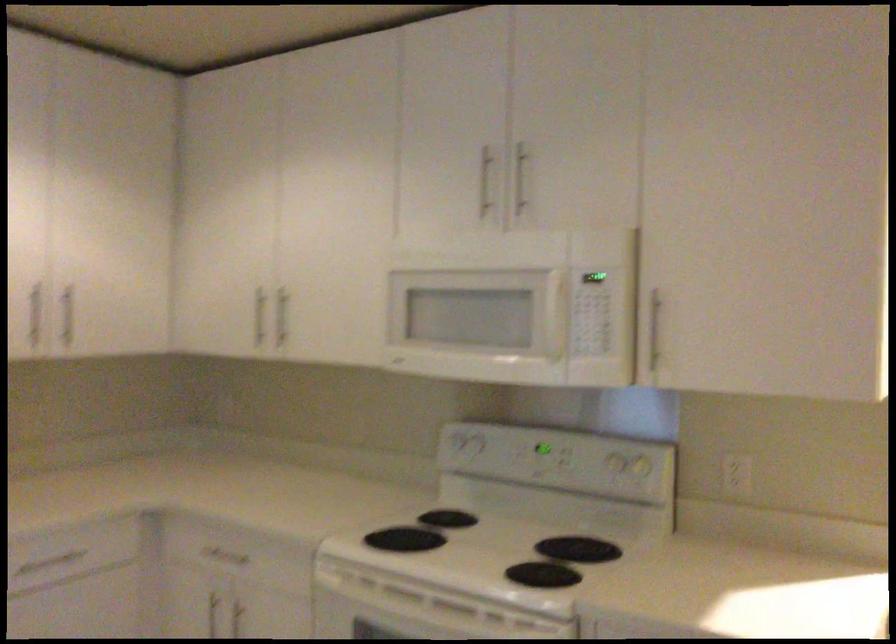
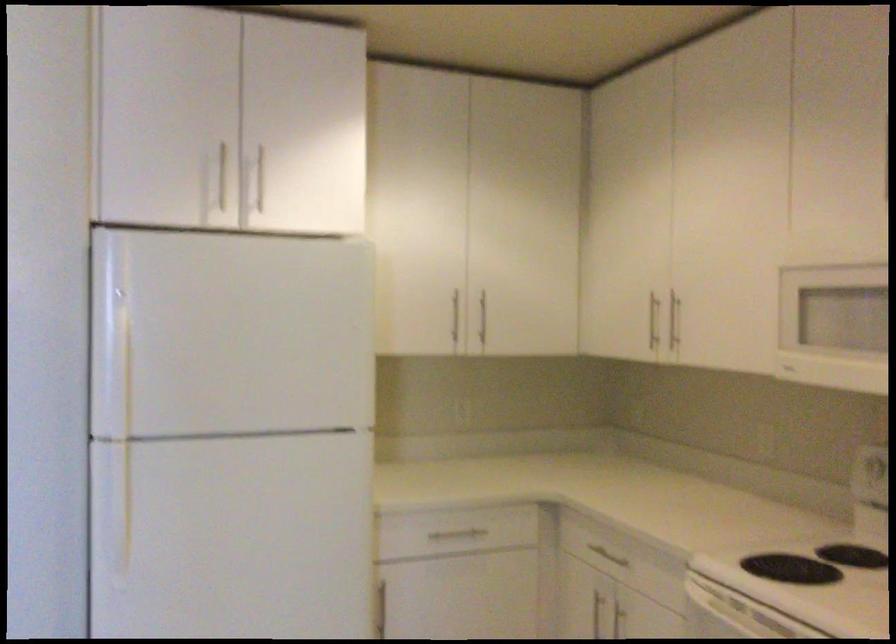
Find the pixel in the second image that matches pixel 259 317 in the first image.

(652, 321)